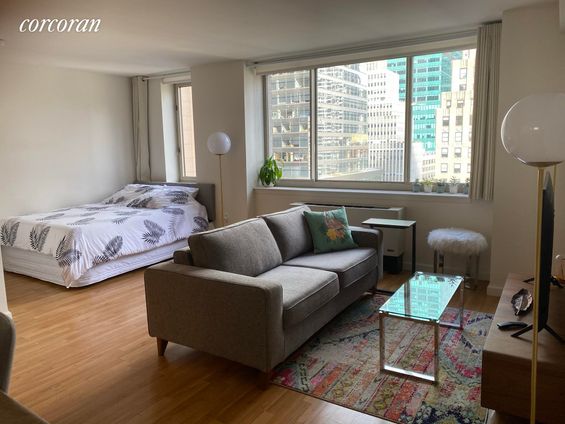
Identify the location of bed. (86, 229).